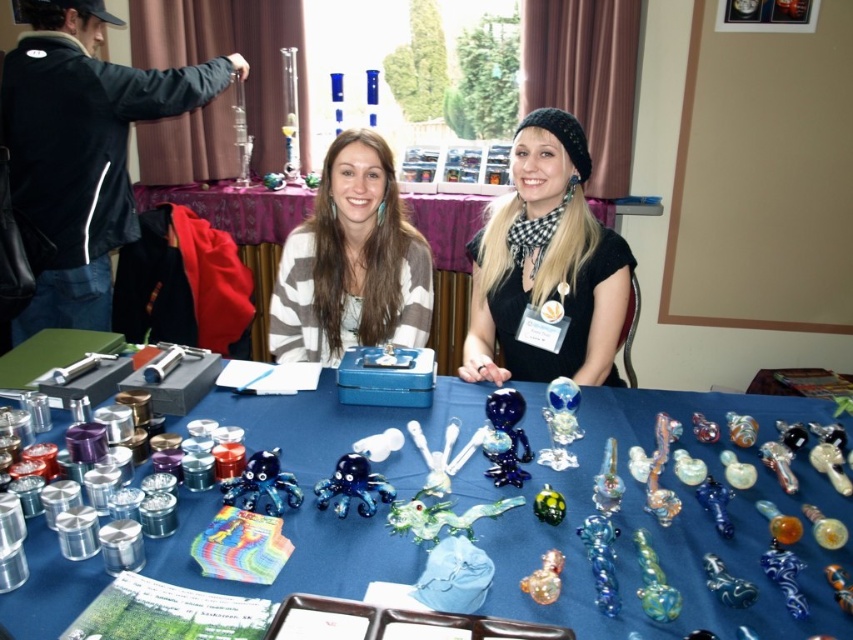
Which is below, black matte scarf at upper center or blue fabric tablecloth at center?

black matte scarf at upper center is below.

Does black matte scarf at upper center appear over blue fabric tablecloth at center?

Actually, black matte scarf at upper center is below blue fabric tablecloth at center.

Find the location of a particular element. The width and height of the screenshot is (853, 640). black matte scarf at upper center is located at coordinates (546, 262).

Does point (805, 544) come behind point (579, 232)?

No, (805, 544) is closer to viewer.

Can you confirm if blue glass pipe at center is smaller than black matte scarf at upper center?

No.

Which is behind, point (808, 582) or point (537, 369)?

Positioned behind is point (537, 369).

Find the location of a particular element. blue glass pipe at center is located at coordinates (662, 528).

Between black matte scarf at upper center and white striped sweater at center, which one has less height?

Standing shorter between the two is white striped sweater at center.

Is point (480, 243) farther from camera compared to point (314, 289)?

Yes.

The width and height of the screenshot is (853, 640). I want to click on black matte scarf at upper center, so click(546, 262).